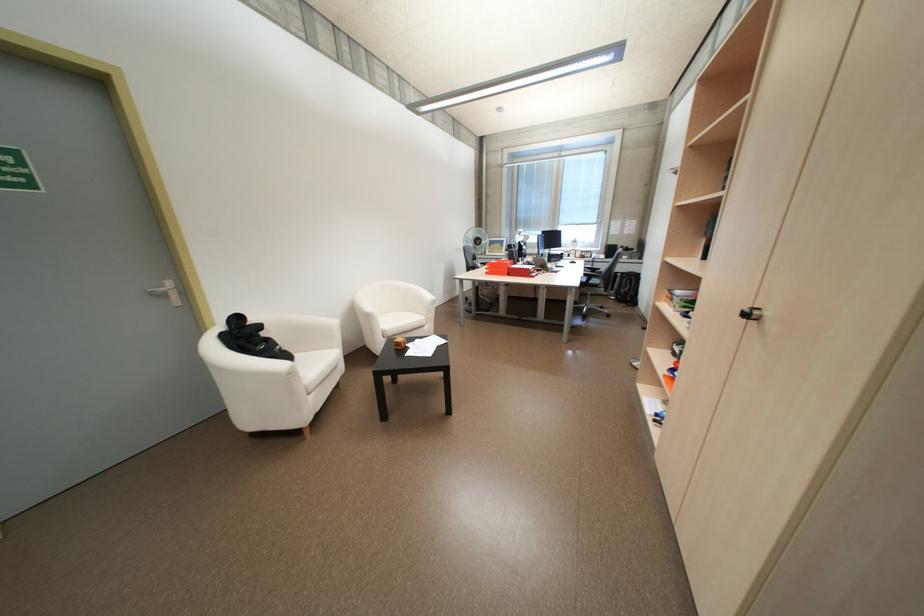
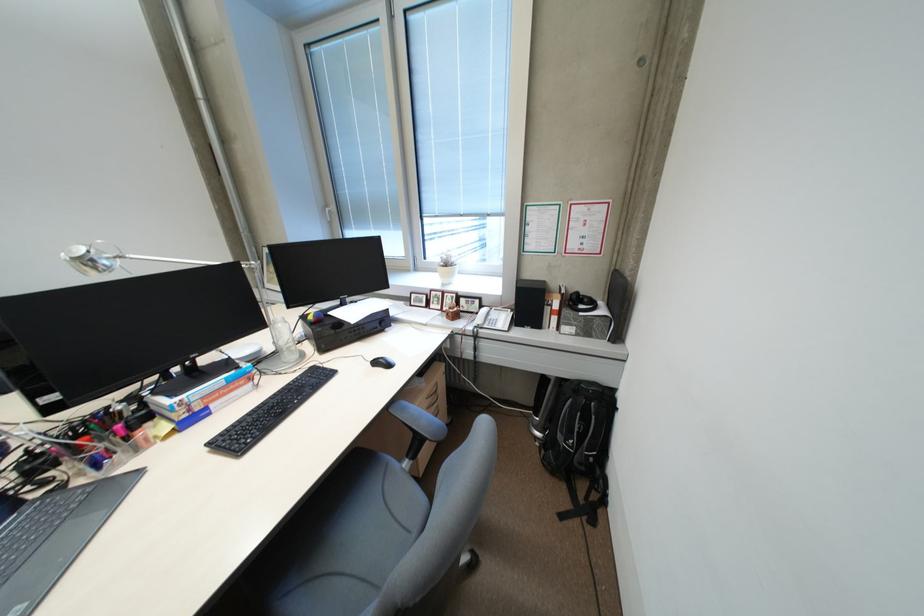
The point at (578,254) is marked in the first image. Where is the corresponding point in the second image?

(438, 304)